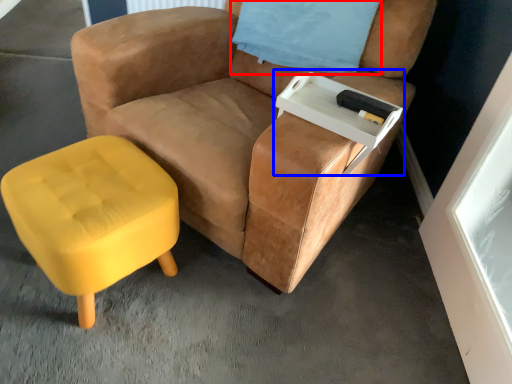
Question: Among these objects, which one is farthest to the camera, pillow (highlighted by a red box) or side table (highlighted by a blue box)?

Choices:
 (A) pillow
 (B) side table

Answer: (A)